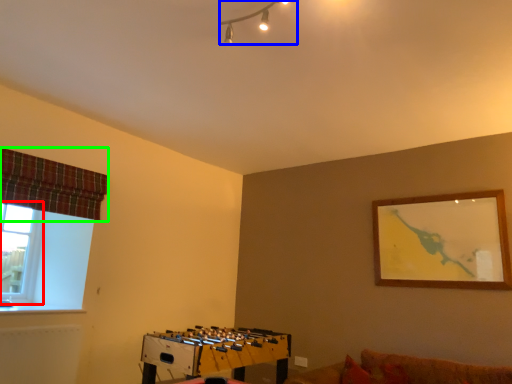
Question: Which object is positioned closest to window (highlighted by a red box)? Select from lamp (highlighted by a blue box) and curtain (highlighted by a green box).

Choices:
 (A) lamp
 (B) curtain

Answer: (B)